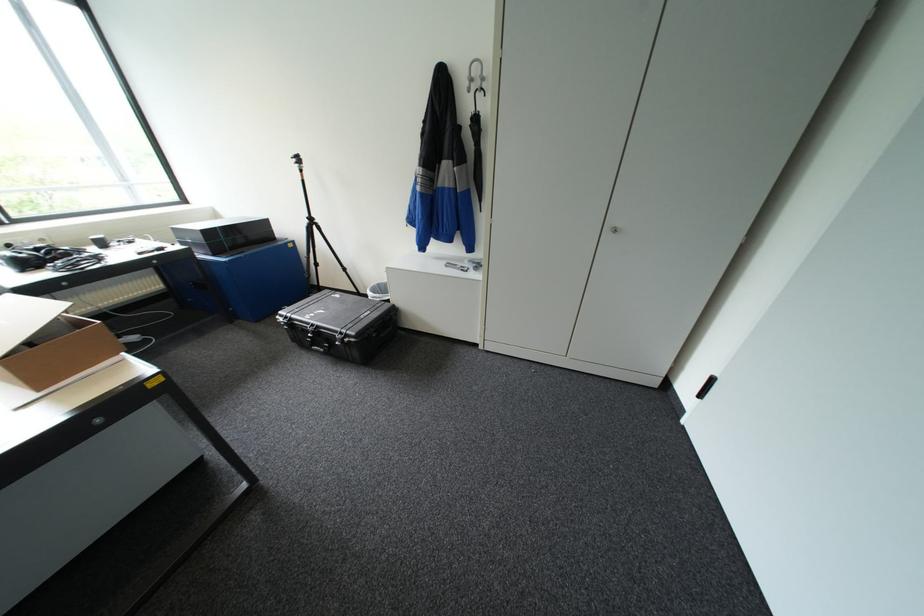
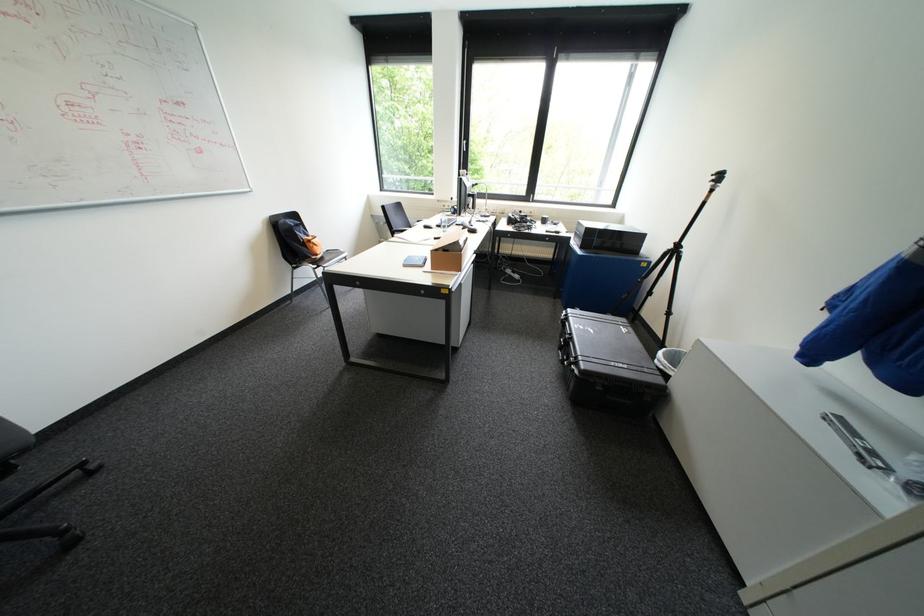
Find the pixel in the second image that matches pixel 322 346 in the first image.

(567, 350)